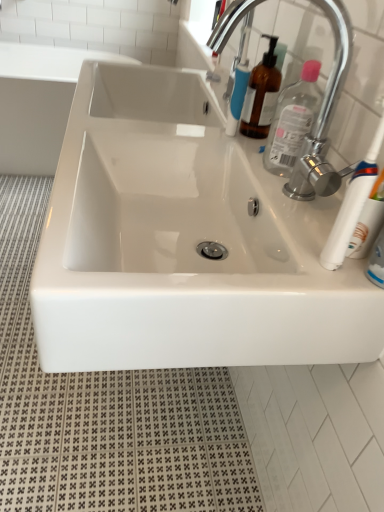
This screenshot has height=512, width=384. What do you see at coordinates (184, 242) in the screenshot?
I see `white glossy sink at center` at bounding box center [184, 242].

This screenshot has width=384, height=512. In order to click on white plastic toothbrush at right in this screenshot , I will do `click(352, 204)`.

The image size is (384, 512). What are the coordinates of `clear plastic bottle at upper right` in the screenshot? It's located at (293, 120).

What do you see at coordinates (293, 120) in the screenshot? Image resolution: width=384 pixels, height=512 pixels. I see `clear plastic bottle at upper right` at bounding box center [293, 120].

What do you see at coordinates (325, 114) in the screenshot?
I see `chrome metallic faucet at upper right` at bounding box center [325, 114].

What are the coordinates of `white glossy sink at center` in the screenshot? It's located at (184, 242).

Is white plastic toothbrush at right thinner than white glossy sink at center?

Indeed, white plastic toothbrush at right has a lesser width compared to white glossy sink at center.

Is white plastic toothbrush at right far from white glossy sink at center?

No, white plastic toothbrush at right is not far from white glossy sink at center.

From the picture: Which is less distant, (375, 147) or (283, 199)?

Point (375, 147) is positioned closer to the camera compared to point (283, 199).

Looking at the image, does white plastic toothbrush at right seem bigger or smaller compared to white glossy sink at center?

white plastic toothbrush at right is smaller than white glossy sink at center.

From a real-world perspective, does white glossy sink at center stand above clear plastic bottle at upper right?

No, from a real-world perspective, white glossy sink at center is not above clear plastic bottle at upper right.

Which object is more forward, white glossy sink at center or clear plastic bottle at upper right?

white glossy sink at center is in front.

Between white glossy sink at center and clear plastic bottle at upper right, which one has less height?

clear plastic bottle at upper right.

Considering their positions, is white plastic toothbrush at right located in front of or behind white glossy sink at upper left?

white plastic toothbrush at right is positioned closer to the viewer than white glossy sink at upper left.

Are white plastic toothbrush at right and white glossy sink at upper left far apart?

white plastic toothbrush at right is positioned a significant distance from white glossy sink at upper left.

From a real-world perspective, which object rests below the other?

white glossy sink at upper left.

Who is bigger, white plastic toothbrush at right or white glossy sink at upper left?

white glossy sink at upper left.

Based on the photo, from a real-world perspective, is white glossy sink at center on chrome metallic faucet at upper right?

No, from a real-world perspective, white glossy sink at center is not above chrome metallic faucet at upper right.

Considering the relative positions of white glossy sink at center and chrome metallic faucet at upper right in the image provided, is white glossy sink at center behind chrome metallic faucet at upper right?

That is True.

Image resolution: width=384 pixels, height=512 pixels. What are the coordinates of `tap above the white glossy sink at center (from the image's perspective)` in the screenshot? It's located at (325, 114).

Considering the positions of points (146, 298) and (345, 72), is point (146, 298) closer to camera compared to point (345, 72)?

Yes, it is in front of point (345, 72).

In the scene shown: Who is shorter, white plastic toothbrush at right or chrome metallic faucet at upper right?

white plastic toothbrush at right is shorter.

Considering the sizes of objects white plastic toothbrush at right and chrome metallic faucet at upper right in the image provided, who is wider, white plastic toothbrush at right or chrome metallic faucet at upper right?

chrome metallic faucet at upper right is wider.

From the image's perspective, which is above, white plastic toothbrush at right or chrome metallic faucet at upper right?

chrome metallic faucet at upper right.

Is white plastic toothbrush at right touching chrome metallic faucet at upper right?

No, white plastic toothbrush at right is not beside chrome metallic faucet at upper right.

Which is more to the right, white glossy sink at upper left or white glossy sink at center?

white glossy sink at center.

Is white glossy sink at upper left next to white glossy sink at center and touching it?

There is a gap between white glossy sink at upper left and white glossy sink at center.

Could you tell me if white glossy sink at upper left is turned towards white glossy sink at center?

Yes, white glossy sink at upper left is aimed at white glossy sink at center.

Is white glossy sink at upper left situated inside white glossy sink at center or outside?

white glossy sink at upper left cannot be found inside white glossy sink at center.

Considering the relative sizes of white glossy sink at center and white plastic toothbrush at right in the image provided, is white glossy sink at center smaller than white plastic toothbrush at right?

No, white glossy sink at center is not smaller than white plastic toothbrush at right.

How many degrees apart are the facing directions of white glossy sink at center and white plastic toothbrush at right?

The angular difference between white glossy sink at center and white plastic toothbrush at right is 0.185 degrees.

From a real-world perspective, which is physically above, white glossy sink at center or white plastic toothbrush at right?

white plastic toothbrush at right, from a real-world perspective.

Is white glossy sink at center next to white plastic toothbrush at right and touching it?

No, white glossy sink at center is not next to white plastic toothbrush at right.

Identify the location of toothbrush located below the white glossy sink at center (from the image's perspective). This screenshot has width=384, height=512. (352, 204).

In order to click on sink that is under the clear plastic bottle at upper right (from a real-world perspective) in this screenshot , I will do `click(184, 242)`.

Which object lies further to the anchor point white glossy sink at upper left, white glossy sink at center or white plastic toothbrush at right?

white plastic toothbrush at right.

When comparing their distances from white glossy sink at center, does white glossy sink at upper left or clear plastic bottle at upper right seem closer?

Among the two, clear plastic bottle at upper right is located nearer to white glossy sink at center.

Looking at the image, which one is located further to white plastic toothbrush at right, white glossy sink at upper left or clear plastic bottle at upper right?

white glossy sink at upper left lies further to white plastic toothbrush at right than the other object.

Which object lies nearer to the anchor point white glossy sink at center, clear plastic bottle at upper right or chrome metallic faucet at upper right?

chrome metallic faucet at upper right is positioned closer to the anchor white glossy sink at center.

Considering their positions, is white plastic toothbrush at right positioned closer to clear plastic bottle at upper right than chrome metallic faucet at upper right?

chrome metallic faucet at upper right is positioned closer to the anchor clear plastic bottle at upper right.

Looking at the image, which one is located further to white plastic toothbrush at right, white glossy sink at upper left or chrome metallic faucet at upper right?

white glossy sink at upper left is further to white plastic toothbrush at right.

Based on their spatial positions, is chrome metallic faucet at upper right or white plastic toothbrush at right closer to clear plastic bottle at upper right?

The object closer to clear plastic bottle at upper right is chrome metallic faucet at upper right.

From the image, which object appears to be farther from clear plastic bottle at upper right, white plastic toothbrush at right or white glossy sink at center?

The object further to clear plastic bottle at upper right is white glossy sink at center.

Locate an element on the screen. tap between white glossy sink at center and white plastic toothbrush at right is located at coordinates (325, 114).

Image resolution: width=384 pixels, height=512 pixels. In order to click on cleaning product located between white glossy sink at center and white glossy sink at upper left in the depth direction in this screenshot , I will do `click(293, 120)`.

At what (x,y) coordinates should I click in order to perform the action: click on sink between chrome metallic faucet at upper right and white glossy sink at upper left in the front-back direction. Please return your answer as a coordinate pair (x, y). Looking at the image, I should click on (184, 242).

Identify the location of tap located between white plastic toothbrush at right and clear plastic bottle at upper right in the depth direction. (325, 114).